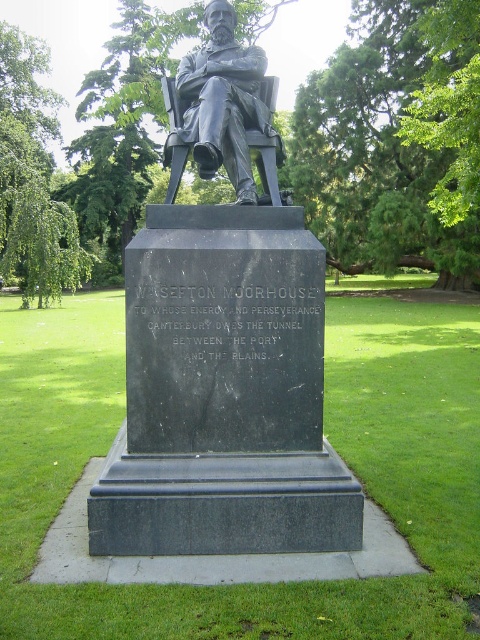
Question: Does black marble statue at center have a larger size compared to bronze statue at center?

Choices:
 (A) yes
 (B) no

Answer: (A)

Question: Can you confirm if black marble statue at center is bigger than bronze statue at center?

Choices:
 (A) yes
 (B) no

Answer: (A)

Question: Which of the following is the closest to the observer?

Choices:
 (A) (225, 122)
 (B) (134, 444)

Answer: (B)

Question: Which point appears closest to the camera in this image?

Choices:
 (A) (201, 115)
 (B) (129, 513)

Answer: (B)

Question: Is black marble statue at center below bronze statue at center?

Choices:
 (A) no
 (B) yes

Answer: (B)

Question: Which point is closer to the camera taking this photo?

Choices:
 (A) (292, 451)
 (B) (229, 157)

Answer: (A)